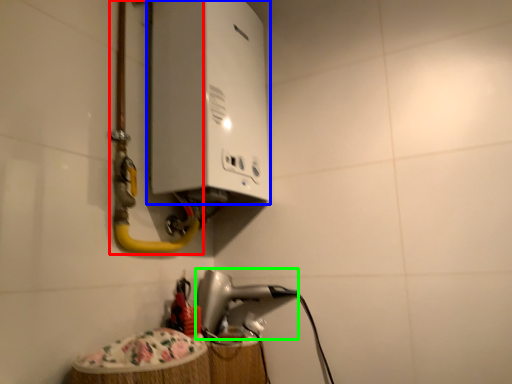
Question: Which object is the farthest from water pipe (highlighted by a red box)? Choose among these: appliance (highlighted by a blue box) or appliance (highlighted by a green box).

Choices:
 (A) appliance
 (B) appliance

Answer: (B)